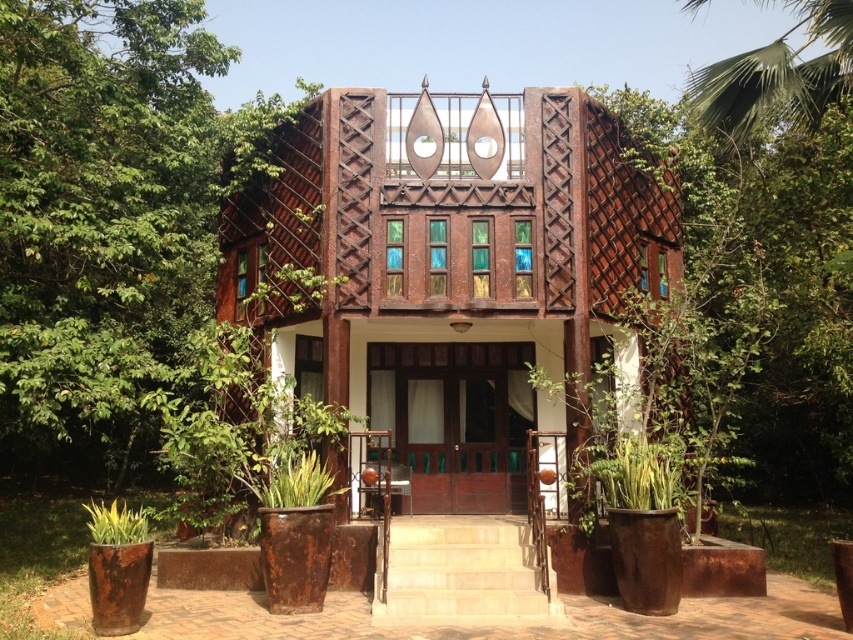
You are standing on the front porch of the house and want to enter through the matte wood door at center. There is a green leafy plant at lower left nearby. Which object is closer to you as you stand on the porch?

The matte wood door at center is closer to you than the green leafy plant at lower left because it is further to the viewer.

You are planning to deliver a package to the front door of the house. You notice the light brown stone stairs at center and the green leafy palm at upper right. Which object is taller, and how does this affect your delivery route?

The light brown stone stairs at center are taller than the green leafy palm at upper right. Since the stairs are taller, you should approach them to reach the front door, as the palm tree is shorter and likely doesn

You are a delivery person trying to deliver a package to the matte wood door at center. However, there is a green leafy palm at upper right blocking your path. Can you walk around it to reach the door?

The matte wood door at center is larger than the green leafy palm at upper right, so the palm is smaller and less obstructive. You can walk around the green leafy palm at upper right to reach the matte wood door at center.